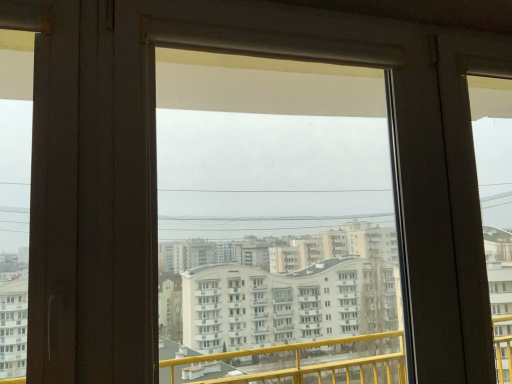
Question: Should I look upward or downward to see transparent plastic window screen at center?

Choices:
 (A) down
 (B) up

Answer: (A)